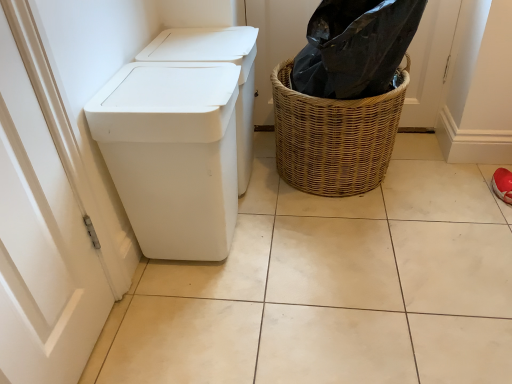
Question: From a real-world perspective, is woven brown basket at right on white plastic waste container at left?

Choices:
 (A) yes
 (B) no

Answer: (B)

Question: Considering the relative sizes of woven brown basket at right and white plastic waste container at left in the image provided, is woven brown basket at right thinner than white plastic waste container at left?

Choices:
 (A) yes
 (B) no

Answer: (B)

Question: From the image's perspective, is woven brown basket at right below white plastic waste container at left?

Choices:
 (A) yes
 (B) no

Answer: (B)

Question: Is white plastic waste container at left completely or partially inside woven brown basket at right?

Choices:
 (A) yes
 (B) no

Answer: (B)

Question: Is woven brown basket at right far away from white plastic waste container at left?

Choices:
 (A) no
 (B) yes

Answer: (A)

Question: From the image's perspective, relative to white matte tile at center, is white plastic waste container at left above or below?

Choices:
 (A) below
 (B) above

Answer: (B)

Question: Considering the positions of white plastic waste container at left and white matte tile at center in the image, is white plastic waste container at left taller or shorter than white matte tile at center?

Choices:
 (A) tall
 (B) short

Answer: (A)

Question: Is point (167, 142) positioned closer to the camera than point (157, 276)?

Choices:
 (A) farther
 (B) closer

Answer: (B)

Question: Is white plastic waste container at left bigger or smaller than white matte tile at center?

Choices:
 (A) big
 (B) small

Answer: (B)

Question: Is white plastic waste container at left taller or shorter than woven brown basket at right?

Choices:
 (A) tall
 (B) short

Answer: (A)

Question: Relative to woven brown basket at right, is white plastic waste container at left in front or behind?

Choices:
 (A) front
 (B) behind

Answer: (A)

Question: Considering the positions of white plastic waste container at left and woven brown basket at right in the image, is white plastic waste container at left bigger or smaller than woven brown basket at right?

Choices:
 (A) small
 (B) big

Answer: (A)

Question: From a real-world perspective, relative to woven brown basket at right, is white plastic waste container at left vertically above or below?

Choices:
 (A) above
 (B) below

Answer: (A)

Question: From a real-world perspective, is white matte tile at center above or below woven brown basket at right?

Choices:
 (A) below
 (B) above

Answer: (A)

Question: Is white matte tile at center bigger or smaller than woven brown basket at right?

Choices:
 (A) big
 (B) small

Answer: (B)